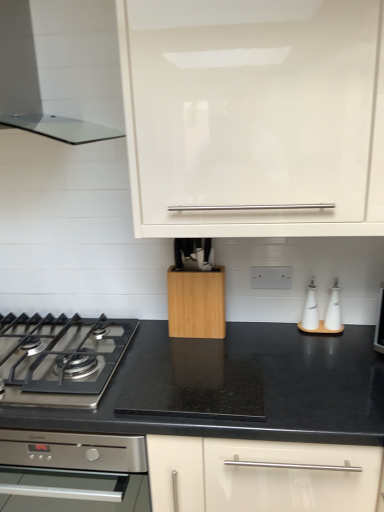
Question: From the image's perspective, is transparent glass range hood at upper left on top of stainless steel gas stove at lower left?

Choices:
 (A) yes
 (B) no

Answer: (A)

Question: Can you confirm if transparent glass range hood at upper left is positioned to the left of stainless steel gas stove at lower left?

Choices:
 (A) no
 (B) yes

Answer: (A)

Question: Is transparent glass range hood at upper left positioned far away from stainless steel gas stove at lower left?

Choices:
 (A) yes
 (B) no

Answer: (B)

Question: Considering the relative sizes of transparent glass range hood at upper left and stainless steel gas stove at lower left in the image provided, is transparent glass range hood at upper left thinner than stainless steel gas stove at lower left?

Choices:
 (A) yes
 (B) no

Answer: (A)

Question: Is transparent glass range hood at upper left facing towards stainless steel gas stove at lower left?

Choices:
 (A) no
 (B) yes

Answer: (A)

Question: From the image's perspective, would you say transparent glass range hood at upper left is shown under stainless steel gas stove at lower left?

Choices:
 (A) yes
 (B) no

Answer: (B)

Question: Does white glossy oil bottles at right have a greater width compared to transparent glass range hood at upper left?

Choices:
 (A) yes
 (B) no

Answer: (B)

Question: Can transparent glass range hood at upper left be found inside white glossy oil bottles at right?

Choices:
 (A) yes
 (B) no

Answer: (B)

Question: Is white glossy oil bottles at right thinner than transparent glass range hood at upper left?

Choices:
 (A) no
 (B) yes

Answer: (B)

Question: From the image's perspective, is white glossy oil bottles at right over transparent glass range hood at upper left?

Choices:
 (A) no
 (B) yes

Answer: (A)

Question: Is white glossy oil bottles at right looking in the opposite direction of transparent glass range hood at upper left?

Choices:
 (A) yes
 (B) no

Answer: (B)

Question: Can you confirm if white glossy oil bottles at right is positioned to the left of transparent glass range hood at upper left?

Choices:
 (A) no
 (B) yes

Answer: (A)

Question: From the image's perspective, is beech wood knife block at center located beneath transparent glass range hood at upper left?

Choices:
 (A) no
 (B) yes

Answer: (B)